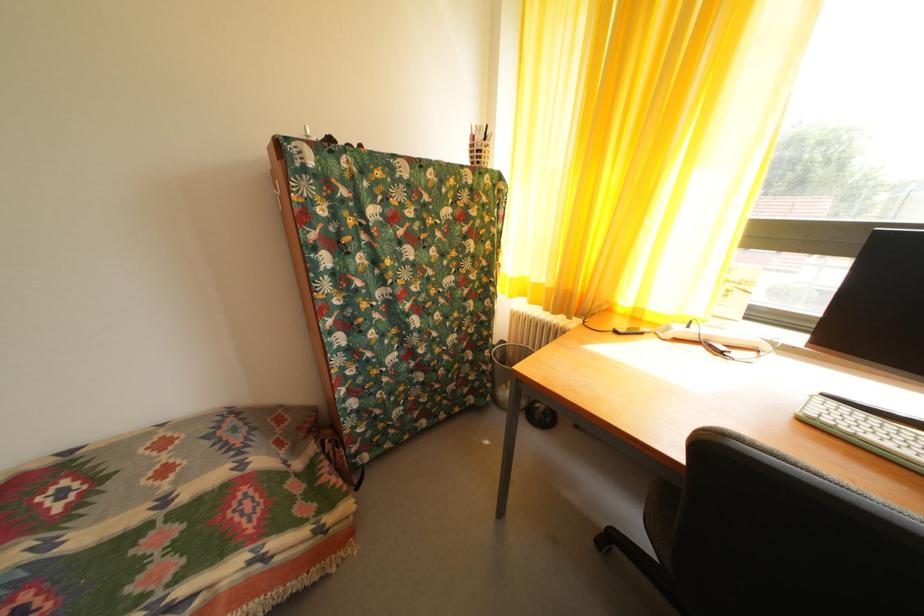
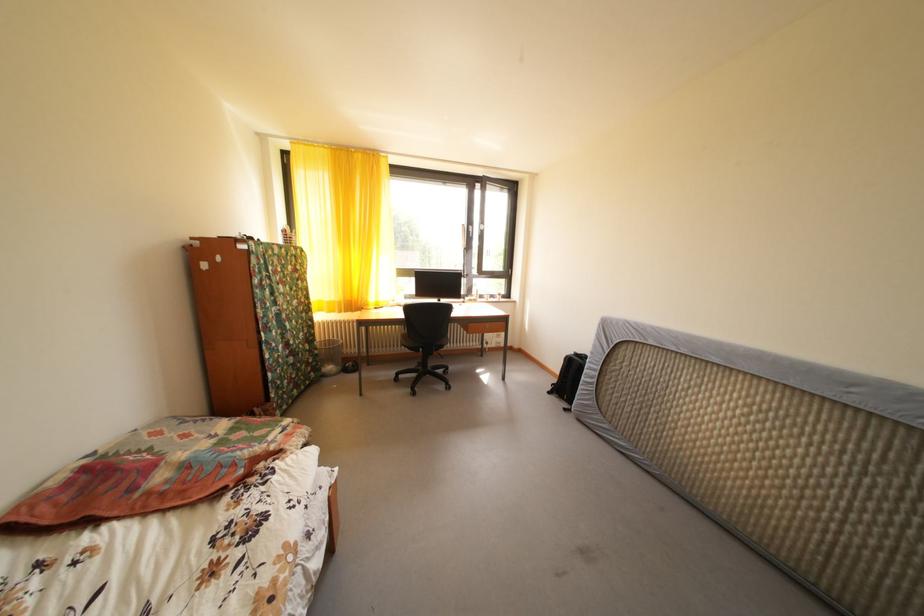
The point at (174, 477) is marked in the first image. Where is the corresponding point in the second image?

(195, 442)